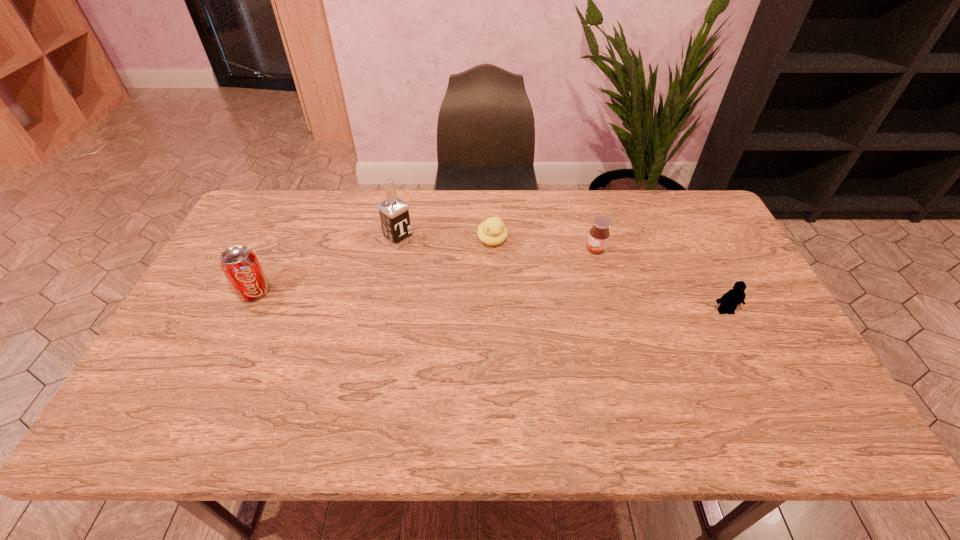
Locate an element on the screen. The image size is (960, 540). the second tallest object is located at coordinates (240, 265).

Locate an element on the screen. the second nearest object is located at coordinates (240, 265).

I want to click on Lego, so (729, 301).

The image size is (960, 540). In order to click on the rightmost object in this screenshot , I will do `click(729, 301)`.

The image size is (960, 540). Find the location of `vodka`. vodka is located at coordinates (394, 214).

Locate an element on the screen. This screenshot has width=960, height=540. the tallest object is located at coordinates (394, 214).

Find the location of a particular element. the fourth object from left to right is located at coordinates (599, 234).

Find the location of a particular element. This screenshot has width=960, height=540. duckling is located at coordinates (492, 231).

Image resolution: width=960 pixels, height=540 pixels. Identify the location of the third object from left to right. (492, 231).

At what (x,y) coordinates should I click in order to perform the action: click on free region located 0.050m on the front of the leftmost object. Please return your answer as a coordinate pair (x, y). The image size is (960, 540). Looking at the image, I should click on (242, 318).